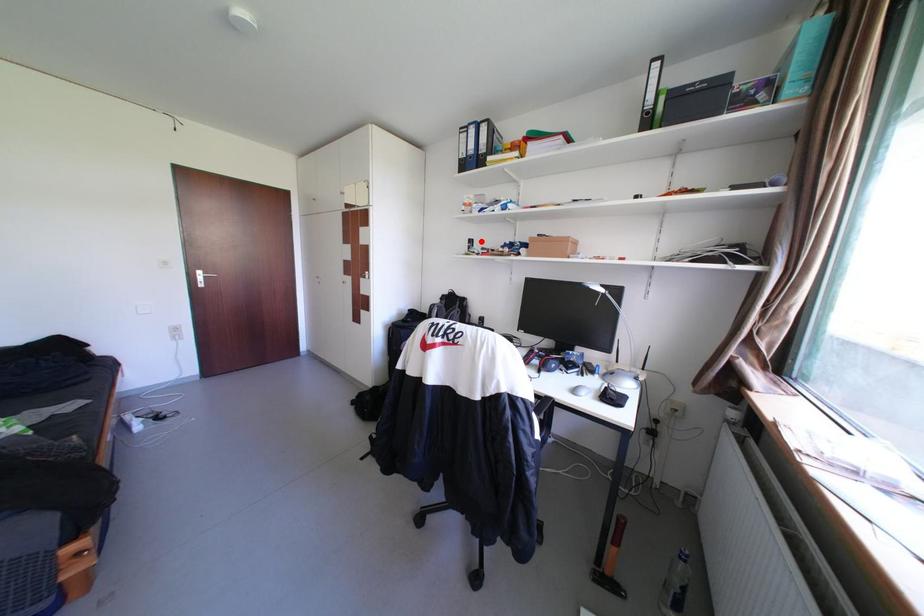
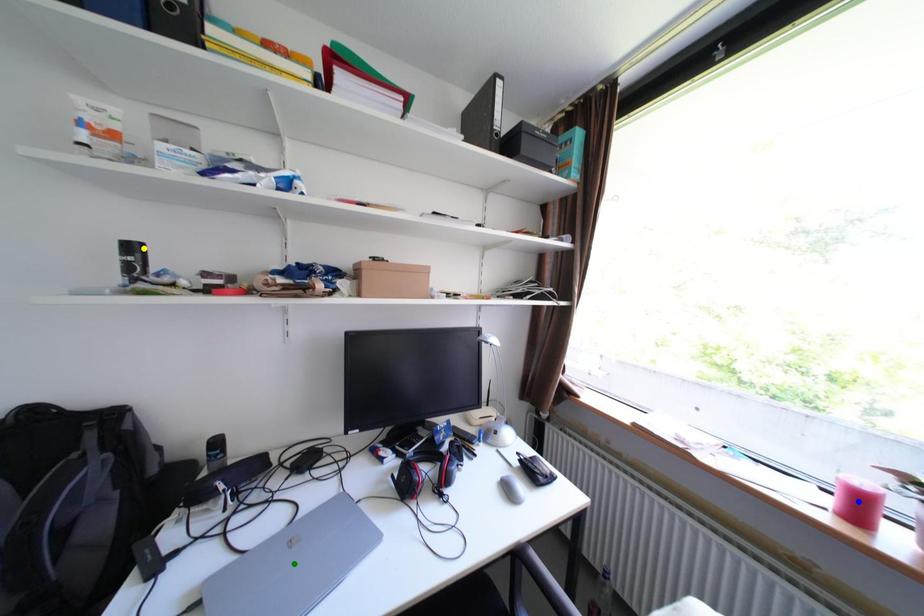
Question: I am providing you with two images of the same scene from different viewpoints. A red point is marked on the first image. You are given multiple points on the second image. In image 2, which mark is for the same physical point as the one in image 1?

Choices:
 (A) green point
 (B) yellow point
 (C) blue point

Answer: (B)